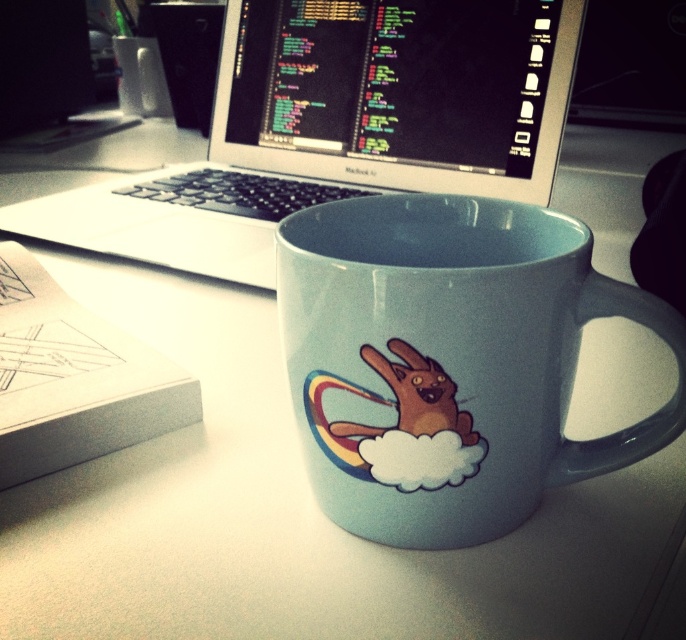
You are setting up a new desk arrangement and want to place a matte ceramic mug at center and a matte black monitor at upper left. Based on the current setup, which object is positioned lower in the workspace?

The matte ceramic mug at center is located below the matte black monitor at upper left, so the matte ceramic mug at center is positioned lower in the workspace.

You are setting up your desk and want to place the sleek silver laptop at upper center and the matte black monitor at upper left. According to the scene, where should you position the laptop relative to the monitor?

The sleek silver laptop at upper center should be placed under the matte black monitor at upper left as it is positioned under it in the scene.

You are setting up a new monitor stand in your workspace. The stand has a base that can only hold items within a 0.2 unit radius from the center point at coordinates 0.2, 0.5. Will the sleek silver laptop at upper center fit on this stand?

The sleek silver laptop at upper center is located at point [340,125], which is within the 0.2 unit radius of the stand base centered at [343,128]. Therefore, it will fit on the stand.